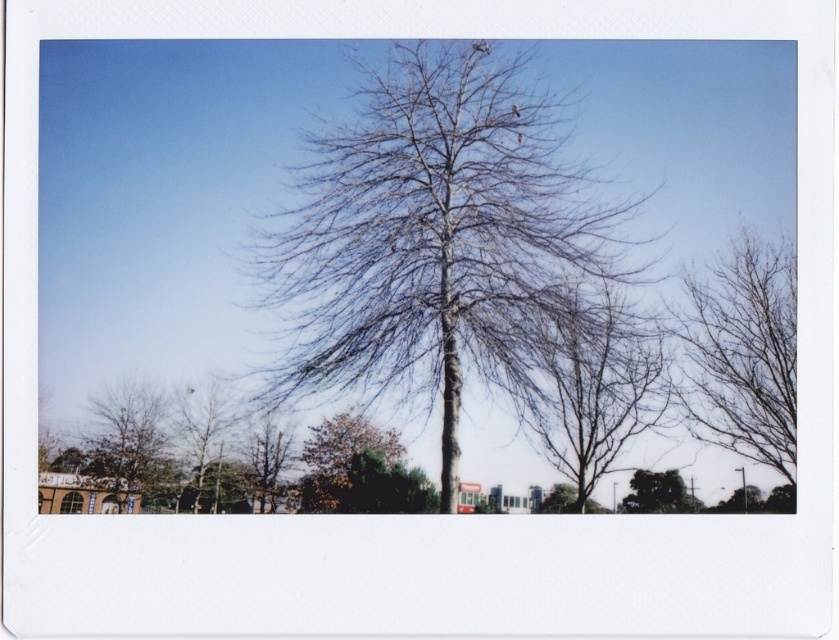
Can you confirm if bare branches at center is taller than green leafy tree at lower right?

No.

The height and width of the screenshot is (640, 839). I want to click on bare branches at center, so click(589, 381).

Is bare wood tree at center further to the viewer compared to brown rough bark tree at lower left?

That is False.

Can you confirm if bare wood tree at center is bigger than brown rough bark tree at lower left?

Indeed, bare wood tree at center has a larger size compared to brown rough bark tree at lower left.

Between point (477, 228) and point (264, 413), which one is positioned behind?

Point (477, 228)

Image resolution: width=839 pixels, height=640 pixels. Identify the location of bare wood tree at center. (438, 240).

Looking at this image, does bare wood tree at center have a greater width compared to bare branches at center?

Indeed, bare wood tree at center has a greater width compared to bare branches at center.

The height and width of the screenshot is (640, 839). What do you see at coordinates (438, 240) in the screenshot?
I see `bare wood tree at center` at bounding box center [438, 240].

At what (x,y) coordinates should I click in order to perform the action: click on bare wood tree at center. Please return your answer as a coordinate pair (x, y). Looking at the image, I should click on (438, 240).